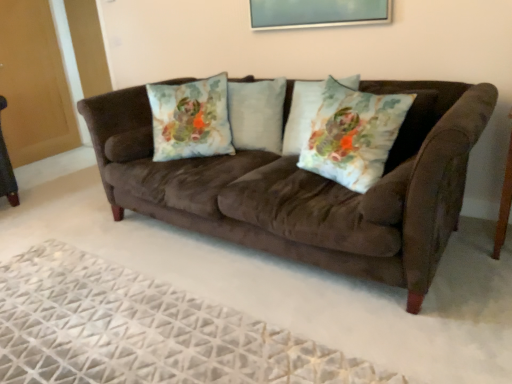
Image resolution: width=512 pixels, height=384 pixels. In order to click on blank space to the left of brown wood side table at right in this screenshot , I will do `click(467, 254)`.